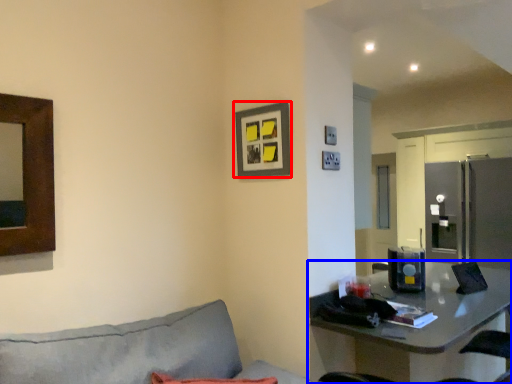
Question: Among these objects, which one is nearest to the camera, picture frame (highlighted by a red box) or table (highlighted by a blue box)?

Choices:
 (A) picture frame
 (B) table

Answer: (B)